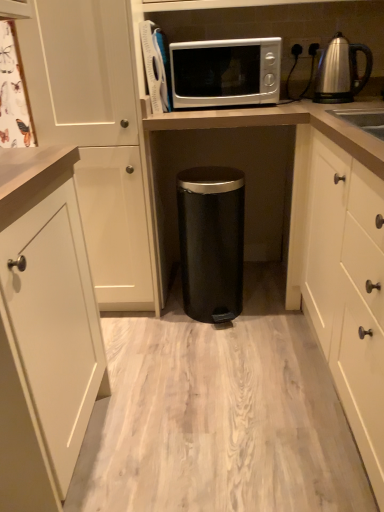
At what (x,y) coordinates should I click in order to perform the action: click on free space on the front side of black matte trash can at center, acting as the second appliance starting from the left. Please return your answer as a coordinate pair (x, y). Image resolution: width=384 pixels, height=512 pixels. Looking at the image, I should click on (225, 346).